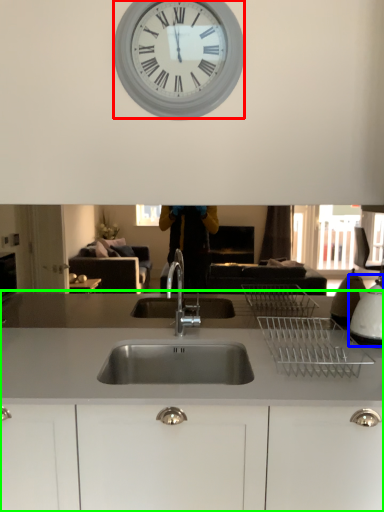
Question: Which is nearer to the wall clock (highlighted by a red box)? appliance (highlighted by a blue box) or countertop (highlighted by a green box).

Choices:
 (A) appliance
 (B) countertop

Answer: (B)